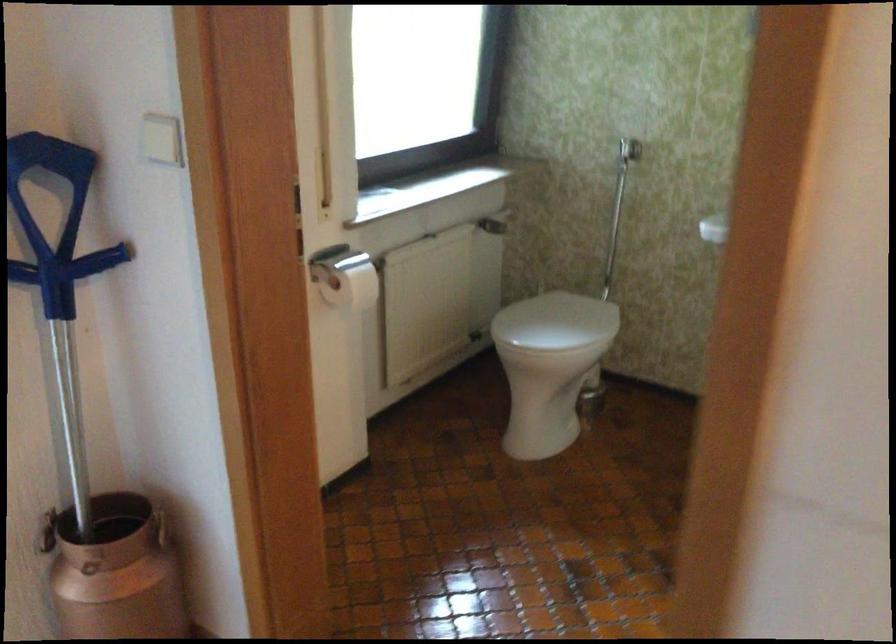
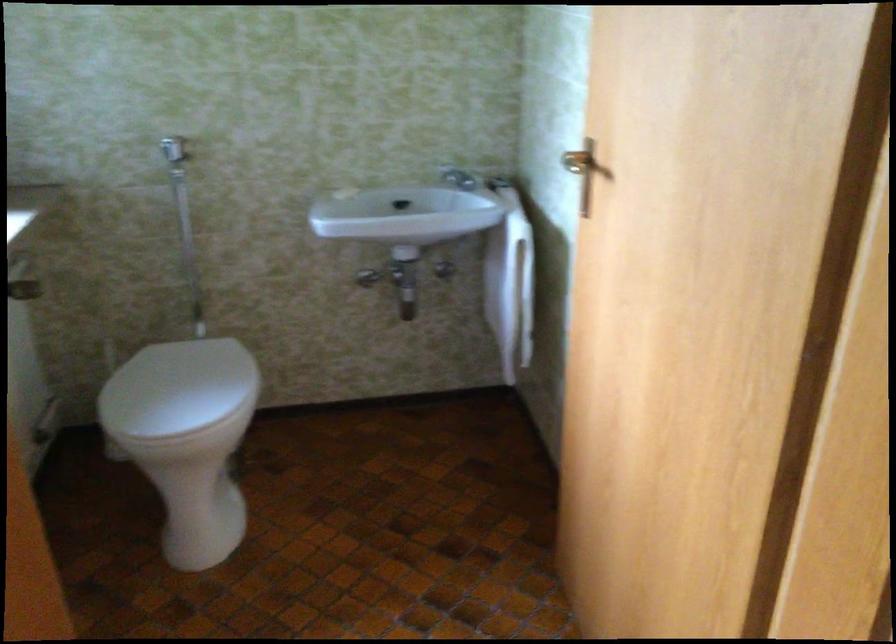
Question: The camera is either moving clockwise (left) or counter-clockwise (right) around the object. The first image is from the beginning of the video and the second image is from the end. Is the camera moving left or right when shooting the video?

Choices:
 (A) Left
 (B) Right

Answer: (A)